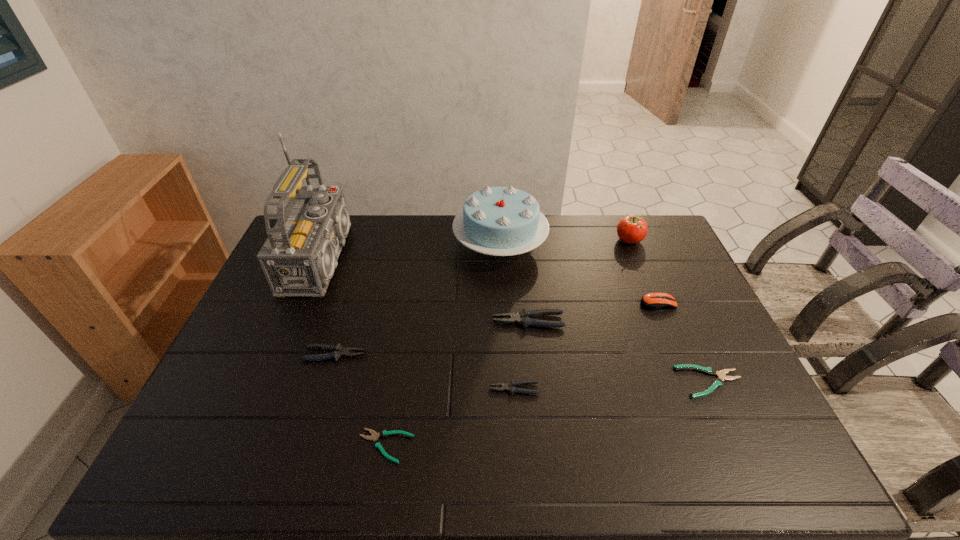
The height and width of the screenshot is (540, 960). In order to click on free space between the fourth nearest pliers and the fifth nearest object in this screenshot , I will do `click(432, 338)`.

Image resolution: width=960 pixels, height=540 pixels. I want to click on blank region between the farther teal pliers and the blue birthday cake, so click(x=605, y=314).

Where is `vacant space in between the fifth shortest object and the leftmost gray pliers`? The width and height of the screenshot is (960, 540). vacant space in between the fifth shortest object and the leftmost gray pliers is located at coordinates (432, 338).

At what (x,y) coordinates should I click in order to perform the action: click on free space that is in between the nearest object and the tomato. Please return your answer as a coordinate pair (x, y). This screenshot has width=960, height=540. Looking at the image, I should click on (507, 343).

The height and width of the screenshot is (540, 960). Find the location of `object that stands as the second closest to the gray radio receiver`. object that stands as the second closest to the gray radio receiver is located at coordinates (501, 221).

Where is `object that is the sixth closest to the bigger teal pliers`? The width and height of the screenshot is (960, 540). object that is the sixth closest to the bigger teal pliers is located at coordinates (377, 443).

Identify which pliers is the fifth nearest to the tomato. Please provide its 2D coordinates. Your answer should be formatted as a tuple, i.e. [(x, y)], where the tuple contains the x and y coordinates of a point satisfying the conditions above.

[(377, 443)]

Locate which pliers ranks in proximity to the radio receiver. Please provide its 2D coordinates. Your answer should be formatted as a tuple, i.e. [(x, y)], where the tuple contains the x and y coordinates of a point satisfying the conditions above.

[(338, 351)]

I want to click on the third closest gray pliers relative to the second shortest object, so click(x=338, y=351).

Point out which gray pliers is positioned as the second nearest to the second smallest gray pliers. Please provide its 2D coordinates. Your answer should be formatted as a tuple, i.e. [(x, y)], where the tuple contains the x and y coordinates of a point satisfying the conditions above.

[(524, 317)]